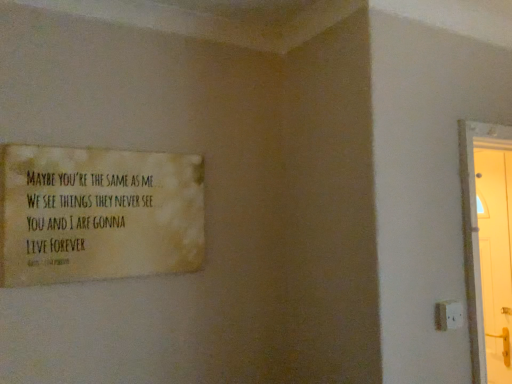
Find the location of a particular element. This screenshot has height=384, width=512. white plastic electric outlet at lower right is located at coordinates (448, 315).

What do you see at coordinates (448, 315) in the screenshot? I see `white plastic electric outlet at lower right` at bounding box center [448, 315].

Measure the distance between point (x=126, y=203) and camera.

The depth of point (x=126, y=203) is 1.38 meters.

Describe the element at coordinates (98, 214) in the screenshot. I see `matte yellow poster at upper left` at that location.

Locate an element on the screen. matte yellow poster at upper left is located at coordinates (98, 214).

Where is `white plastic electric outlet at lower right`? This screenshot has height=384, width=512. white plastic electric outlet at lower right is located at coordinates (448, 315).

Can you confirm if matte yellow poster at upper left is positioned to the right of white plastic electric outlet at lower right?

No.

Between matte yellow poster at upper left and white plastic electric outlet at lower right, which one is positioned behind?

Positioned behind is white plastic electric outlet at lower right.

Which is nearer, (30, 279) or (439, 322)?

The point (30, 279) is closer.

Looking at this image, from the image's perspective, would you say matte yellow poster at upper left is shown under white plastic electric outlet at lower right?

Incorrect, from the image's perspective, matte yellow poster at upper left is higher than white plastic electric outlet at lower right.

From a real-world perspective, does matte yellow poster at upper left sit lower than white plastic electric outlet at lower right?

No, from a real-world perspective, matte yellow poster at upper left is not below white plastic electric outlet at lower right.

Which of these two, matte yellow poster at upper left or white plastic electric outlet at lower right, is wider?

Wider between the two is matte yellow poster at upper left.

Who is shorter, matte yellow poster at upper left or white plastic electric outlet at lower right?

white plastic electric outlet at lower right.

In the scene shown: Who is bigger, matte yellow poster at upper left or white plastic electric outlet at lower right?

With larger size is matte yellow poster at upper left.

Is matte yellow poster at upper left inside the boundaries of white plastic electric outlet at lower right, or outside?

The correct answer is: outside.

Can you see matte yellow poster at upper left touching white plastic electric outlet at lower right?

No, matte yellow poster at upper left is not in contact with white plastic electric outlet at lower right.

Is matte yellow poster at upper left oriented towards white plastic electric outlet at lower right?

No, matte yellow poster at upper left is not oriented towards white plastic electric outlet at lower right.

I want to click on poster that appears above the white plastic electric outlet at lower right (from a real-world perspective), so click(98, 214).

Between white plastic electric outlet at lower right and matte yellow poster at upper left, which one appears on the left side from the viewer's perspective?

matte yellow poster at upper left.

Does white plastic electric outlet at lower right lie in front of matte yellow poster at upper left?

No, it is not.

Which is further, (447, 308) or (164, 207)?

The point (164, 207) is behind.

Consider the image. From the image's perspective, which one is positioned lower, white plastic electric outlet at lower right or matte yellow poster at upper left?

From the image's view, white plastic electric outlet at lower right is below.

From a real-world perspective, is white plastic electric outlet at lower right above or below matte yellow poster at upper left?

In terms of real-world spatial position, white plastic electric outlet at lower right is below matte yellow poster at upper left.

Which object is thinner, white plastic electric outlet at lower right or matte yellow poster at upper left?

white plastic electric outlet at lower right.

Which of these two, white plastic electric outlet at lower right or matte yellow poster at upper left, stands taller?

matte yellow poster at upper left.

Considering the sizes of objects white plastic electric outlet at lower right and matte yellow poster at upper left in the image provided, who is bigger, white plastic electric outlet at lower right or matte yellow poster at upper left?

With larger size is matte yellow poster at upper left.

Would you say white plastic electric outlet at lower right is inside or outside matte yellow poster at upper left?

white plastic electric outlet at lower right is outside matte yellow poster at upper left.

Is white plastic electric outlet at lower right next to matte yellow poster at upper left?

No, white plastic electric outlet at lower right is not making contact with matte yellow poster at upper left.

Is white plastic electric outlet at lower right looking in the opposite direction of matte yellow poster at upper left?

No, white plastic electric outlet at lower right is not facing away from matte yellow poster at upper left.

Looking at this image, measure the distance from white plastic electric outlet at lower right to matte yellow poster at upper left.

white plastic electric outlet at lower right and matte yellow poster at upper left are 3.65 feet apart.

The image size is (512, 384). I want to click on electric outlet on the right of matte yellow poster at upper left, so click(x=448, y=315).

This screenshot has width=512, height=384. Find the location of `poster above the white plastic electric outlet at lower right (from the image's perspective)`. poster above the white plastic electric outlet at lower right (from the image's perspective) is located at coordinates (98, 214).

Identify the location of electric outlet behind the matte yellow poster at upper left. (448, 315).